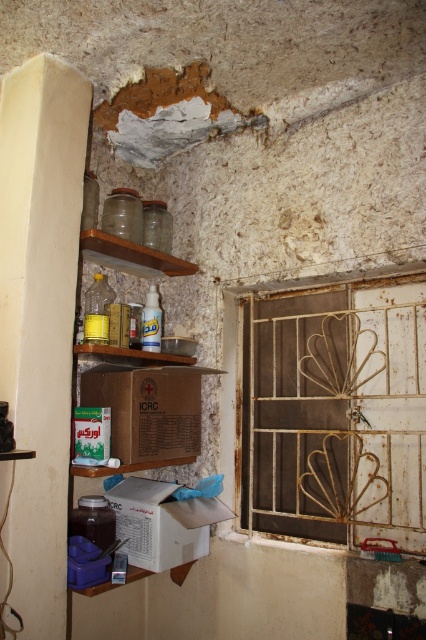
From the picture: Does brown cardboard box at center have a lesser height compared to white cardboard box at lower center?

Incorrect, brown cardboard box at center's height does not fall short of white cardboard box at lower center's.

At what (x,y) coordinates should I click in order to perform the action: click on brown cardboard box at center. Please return your answer as a coordinate pair (x, y). The image size is (426, 640). Looking at the image, I should click on point(146,408).

Is rusty metal gate at center-right above brown cardboard box at center?

Indeed, rusty metal gate at center-right is positioned over brown cardboard box at center.

Does point (252, 477) lie in front of point (155, 410)?

No, it is not.

The width and height of the screenshot is (426, 640). Find the location of `rusty metal gate at center-right`. rusty metal gate at center-right is located at coordinates (331, 404).

Does point (210, 504) come behind point (155, 266)?

No, (210, 504) is in front of (155, 266).

Between point (155, 508) and point (112, 266), which one is positioned behind?

The point (112, 266) is more distant.

The height and width of the screenshot is (640, 426). Identify the location of white cardboard box at lower center. (163, 522).